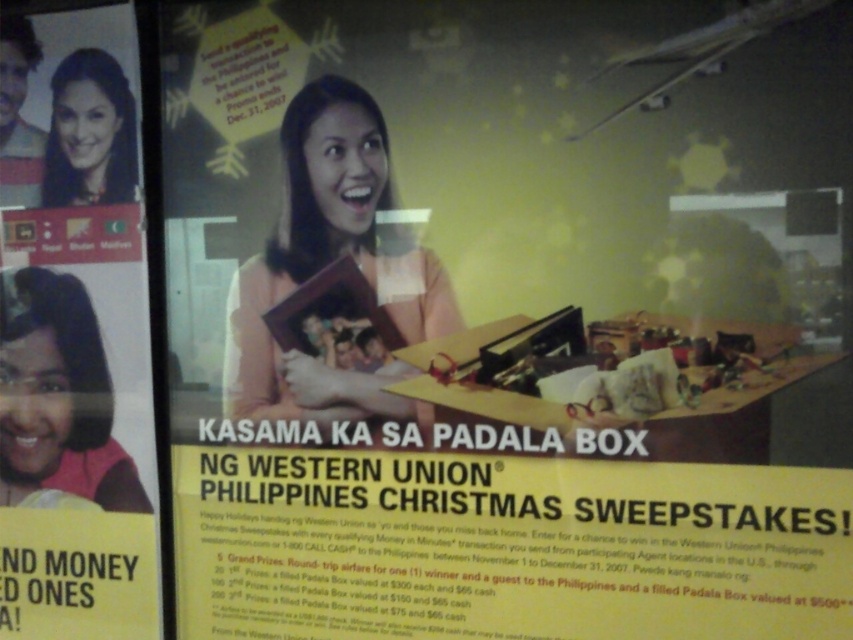
Question: Does yellow paper advertisement at upper left lie in front of matte black hair at upper left?

Choices:
 (A) yes
 (B) no

Answer: (B)

Question: Is matte orange shirt at center above matte pink shirt at left?

Choices:
 (A) no
 (B) yes

Answer: (B)

Question: Which object is farther from the camera taking this photo?

Choices:
 (A) matte orange shirt at center
 (B) matte black hair at upper left

Answer: (B)

Question: Does yellow paper advertisement at upper left have a larger size compared to matte orange shirt at center?

Choices:
 (A) yes
 (B) no

Answer: (A)

Question: Which point is closer to the camera taking this photo?

Choices:
 (A) (67, 442)
 (B) (64, 93)

Answer: (B)

Question: Which point is closer to the camera?

Choices:
 (A) (347, 417)
 (B) (24, 400)

Answer: (A)